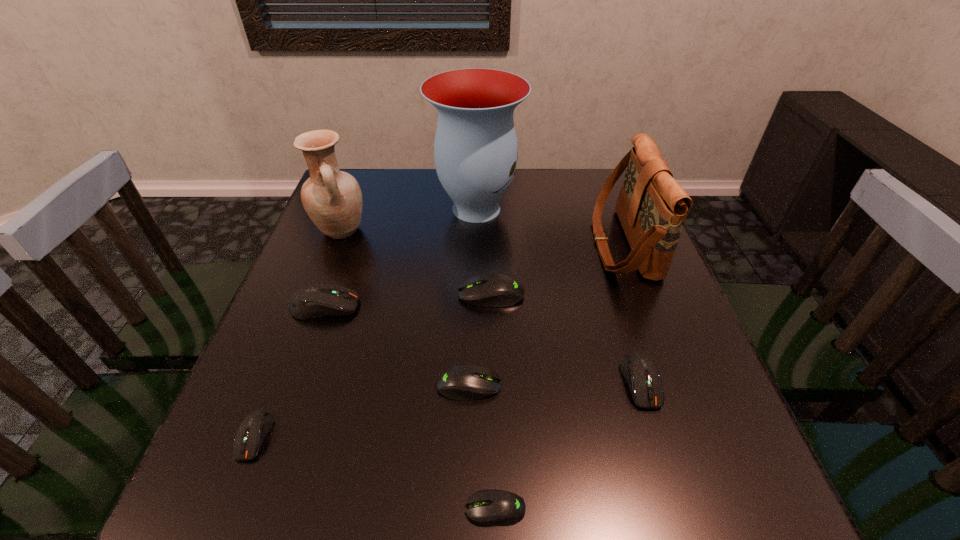
What are the coordinates of `free location located 0.390m on the wheel side of the biggest gray computer mouse` in the screenshot? It's located at (284, 295).

At what (x,y) coordinates should I click in order to perform the action: click on vacant space located on the wheel side of the biggest gray computer mouse. Please return your answer as a coordinate pair (x, y). This screenshot has height=540, width=960. Looking at the image, I should click on (333, 295).

Find the location of `vacant space situated on the button of the second smallest dark computer equipment`. vacant space situated on the button of the second smallest dark computer equipment is located at coordinates (671, 480).

You are a GUI agent. You are given a task and a screenshot of the screen. Output one action in this format:
    pyautogui.click(x=<x>, y=<y>)
    Task: Click on the free spot located on the wheel side of the second nearest gray computer mouse
    
    Given the screenshot: What is the action you would take?
    pyautogui.click(x=614, y=385)

At what (x,y) coordinates should I click in order to perform the action: click on vacant space located on the button of the smallest dark computer equipment. Please return your answer as a coordinate pair (x, y). Looking at the image, I should click on (228, 502).

Where is `blank space located on the wheel side of the nearest gray computer mouse`? The height and width of the screenshot is (540, 960). blank space located on the wheel side of the nearest gray computer mouse is located at coordinates (325, 509).

Identify the location of free space located 0.300m on the wheel side of the nearest gray computer mouse. (265, 509).

The height and width of the screenshot is (540, 960). Identify the location of free point located 0.390m on the wheel side of the nearest gray computer mouse. (x=205, y=509).

Locate an element on the screen. vase at the far edge is located at coordinates (475, 151).

Where is `shoulder bag that is at the far edge`? The image size is (960, 540). shoulder bag that is at the far edge is located at coordinates (652, 207).